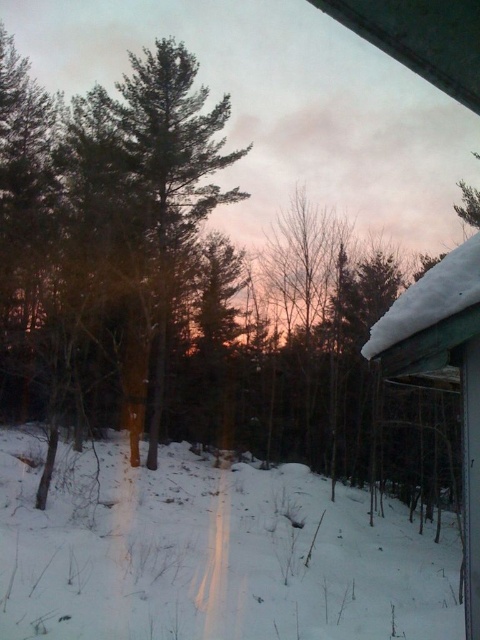
Question: Among these points, which one is nearest to the camera?

Choices:
 (A) (228, 483)
 (B) (460, 301)

Answer: (B)

Question: In this image, where is white fluffy snow at center located relative to snow-covered wood hut at right?

Choices:
 (A) left
 (B) right

Answer: (A)

Question: Can you confirm if white fluffy snow at center is bigger than snow-covered wood hut at right?

Choices:
 (A) yes
 (B) no

Answer: (A)

Question: Which of the following is the closest to the observer?

Choices:
 (A) snow-covered wood hut at right
 (B) white fluffy snow at center

Answer: (A)

Question: Is white fluffy snow at center to the left of snow-covered wood hut at right from the viewer's perspective?

Choices:
 (A) yes
 (B) no

Answer: (A)